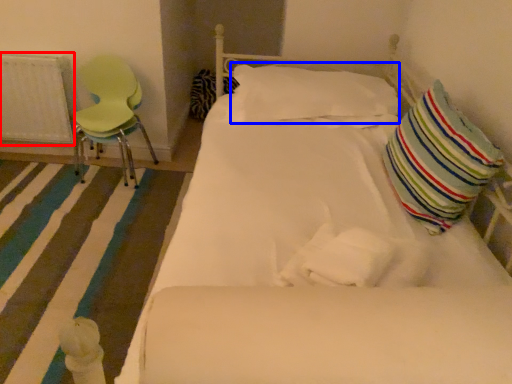
Question: Among these objects, which one is nearest to the camera, radiator (highlighted by a red box) or pillow (highlighted by a blue box)?

Choices:
 (A) radiator
 (B) pillow

Answer: (B)